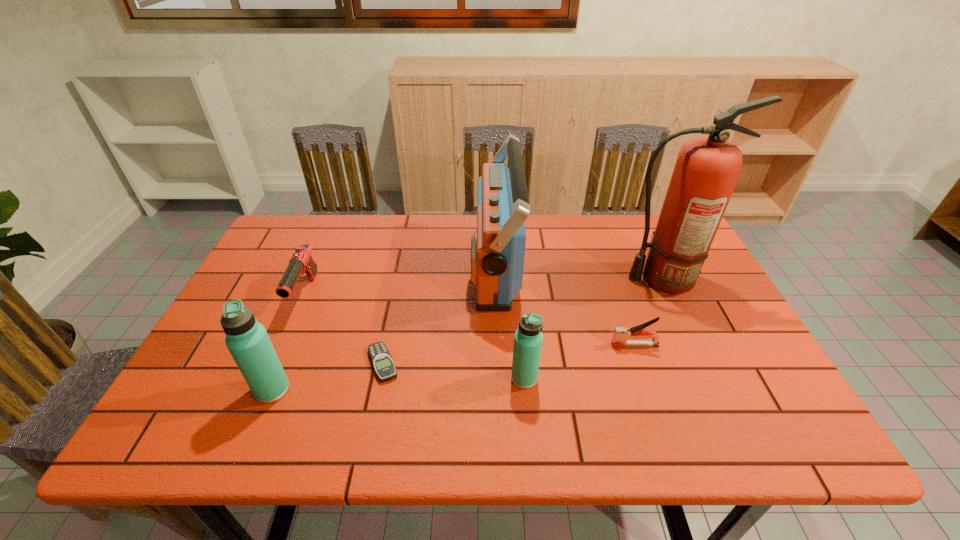
All thermos bottles are currently evenly spaced. To continue this pattern, where would you add another thermos bottle on the right? Please point out a vacant spot. Please provide its 2D coordinates. Your answer should be formatted as a tuple, i.e. [(x, y)], where the tuple contains the x and y coordinates of a point satisfying the conditions above.

[(765, 367)]